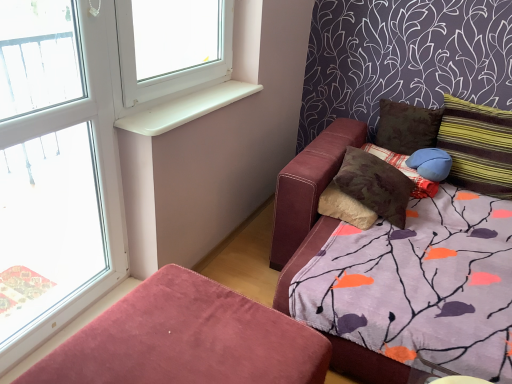
At what (x,y) coordinates should I click in order to perform the action: click on blank space situated above velvet ottoman at lower left (from a real-world perspective). Please return your answer as a coordinate pair (x, y). The height and width of the screenshot is (384, 512). Looking at the image, I should click on (177, 334).